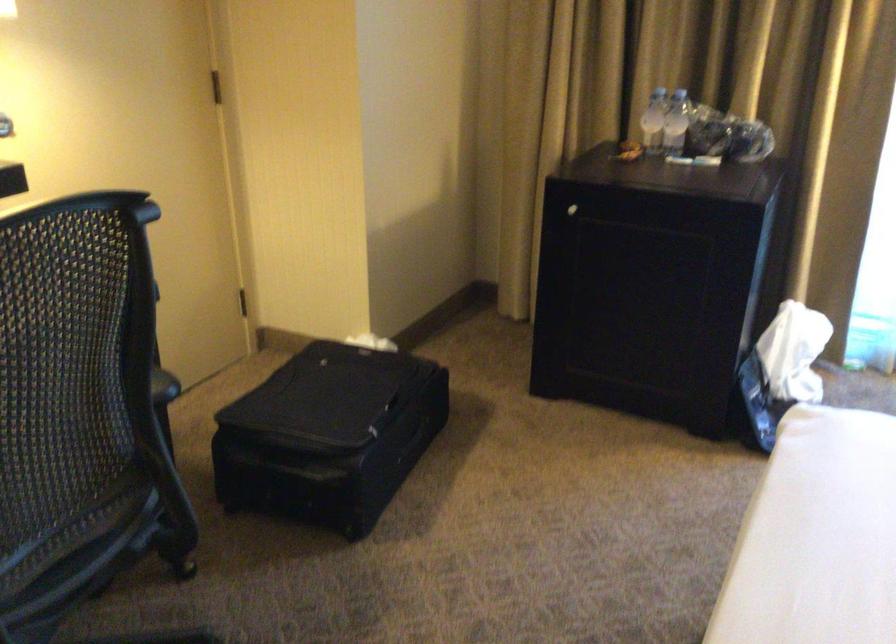
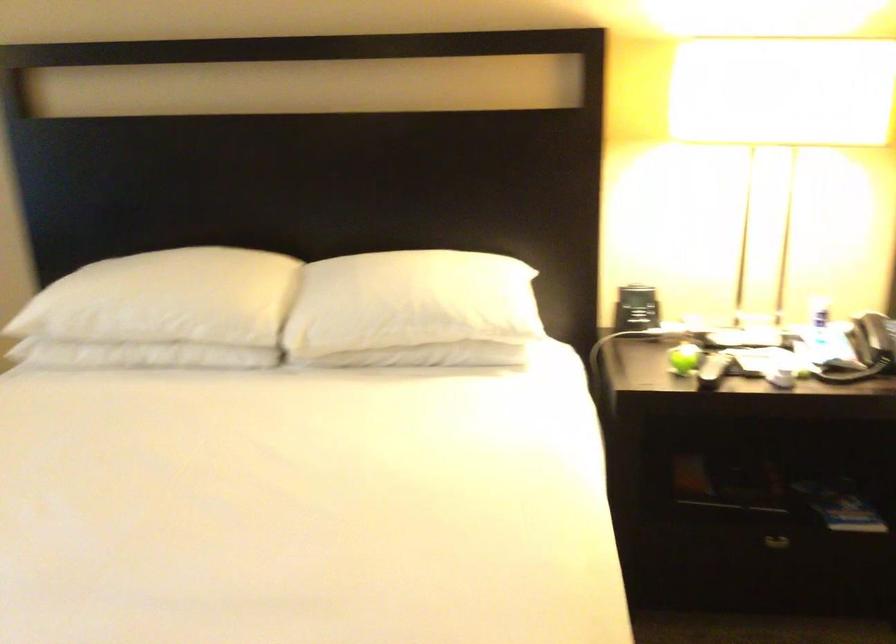
The first image is from the beginning of the video and the second image is from the end. How did the camera likely rotate when shooting the video?

The rotation direction of the camera is right-down.